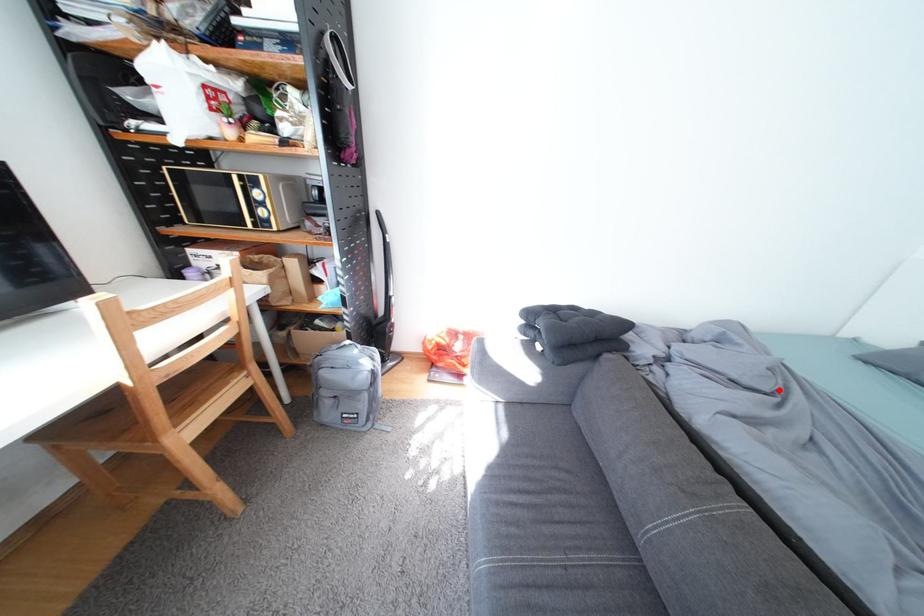
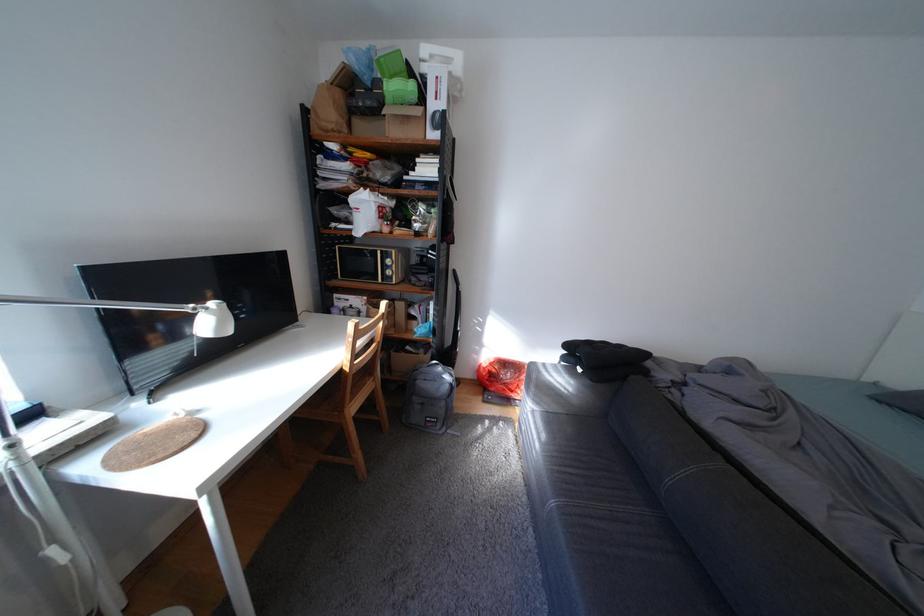
Find the pixel in the second image that matches the highlighted location in the first image.

(773, 407)